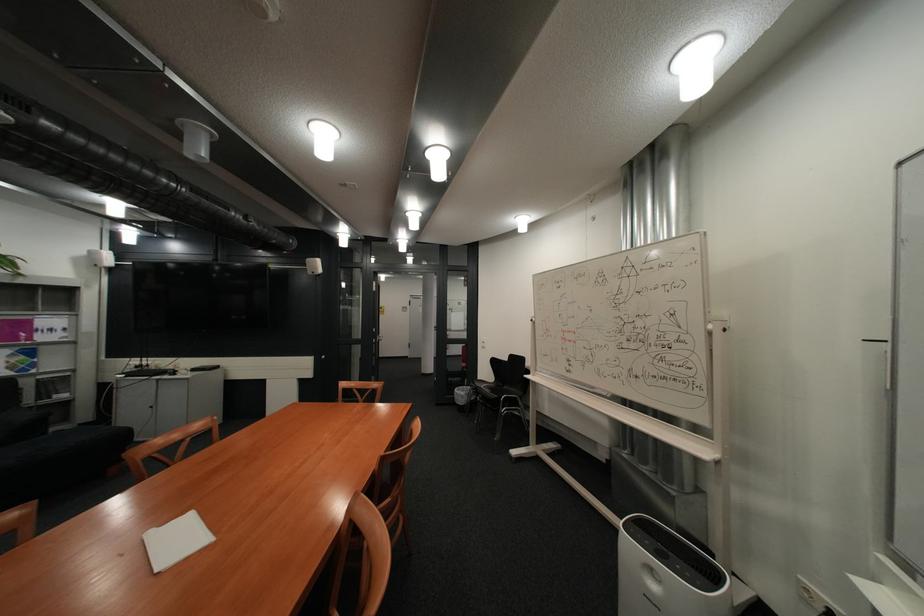
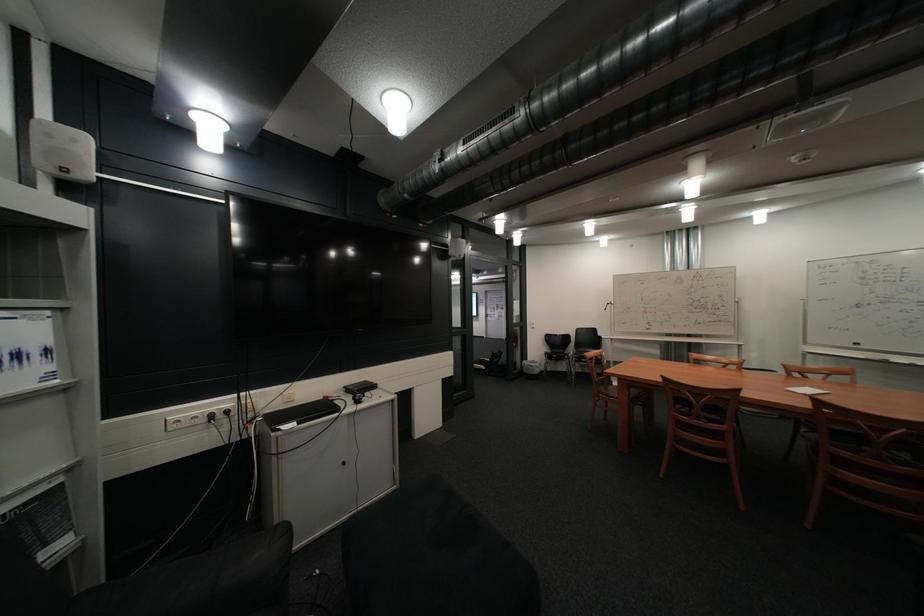
Where in the second image is the point corresponding to point (70, 339) from the first image?

(46, 386)